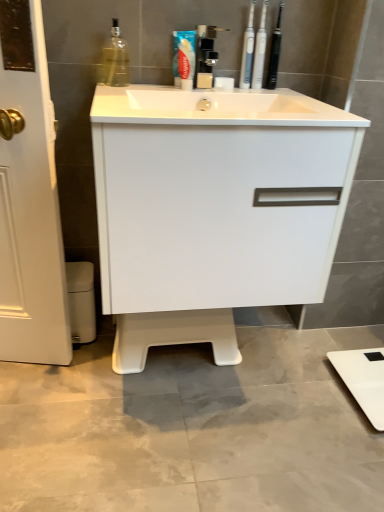
Question: From their relative heights in the image, would you say black plastic toothbrushes at upper center, which is the 3th toiletry from left to right, is taller or shorter than satin nickel faucet at upper center?

Choices:
 (A) tall
 (B) short

Answer: (A)

Question: Is black plastic toothbrushes at upper center, which is the 3th toiletry from left to right, to the left or to the right of satin nickel faucet at upper center in the image?

Choices:
 (A) right
 (B) left

Answer: (A)

Question: Which object is the closest to the blue glossy toothpaste at upper center?

Choices:
 (A) white glossy sink at center
 (B) white plastic toothbrushes at upper center, which is the second toiletry in left-to-right order
 (C) translucent glass bottle at upper left
 (D) black plastic toothbrushes at upper center, which is the 3th toiletry from left to right
 (E) white plastic toothbrushes at upper right, placed as the third toiletry when sorted from right to left

Answer: (E)

Question: Which object is the farthest from the white glossy sink at center?

Choices:
 (A) white plastic toothbrushes at upper center, which is the second toiletry in left-to-right order
 (B) satin nickel faucet at upper center
 (C) blue glossy toothpaste at upper center
 (D) white glossy cabinet at center
 (E) white plastic toothbrushes at upper right, which is the first toiletry from left to right

Answer: (A)